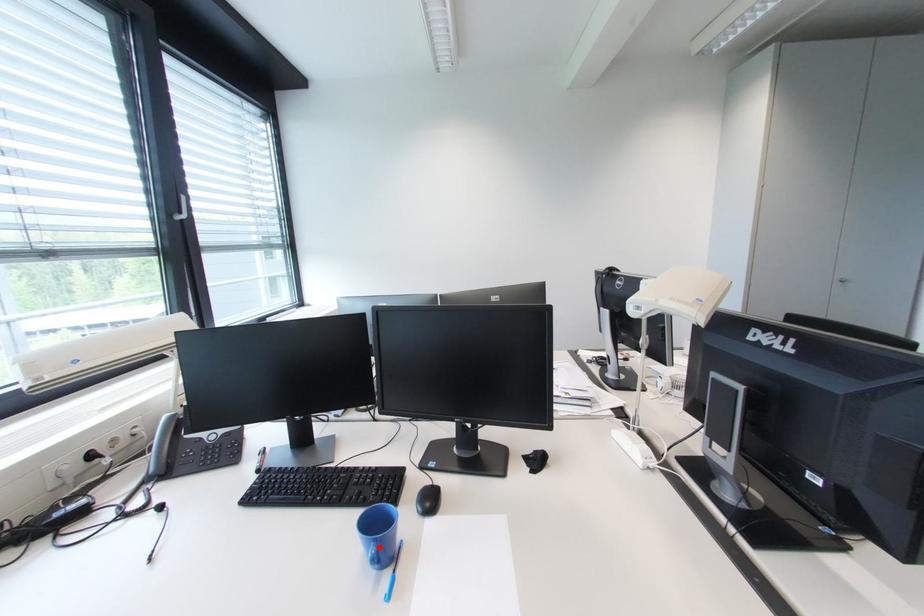
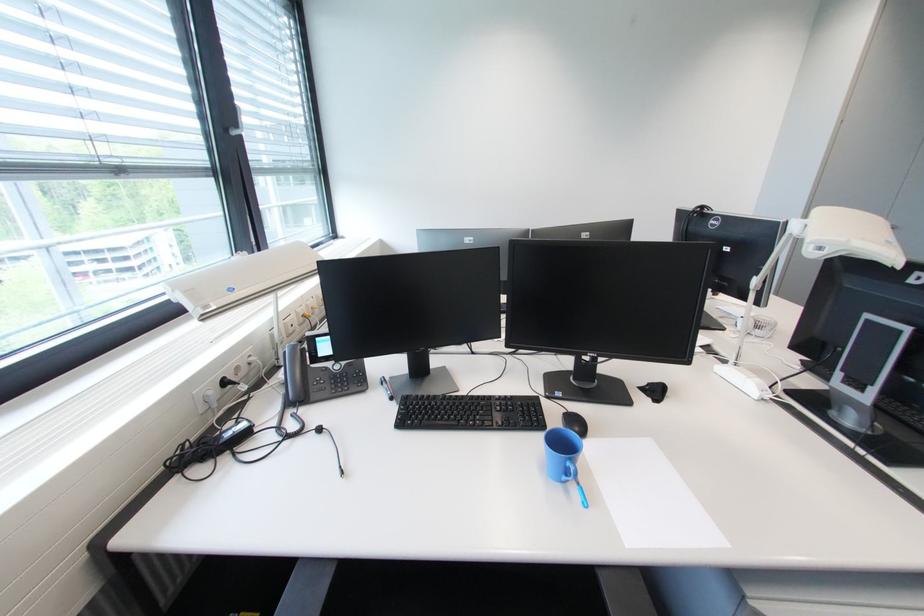
The point at the highlighted location is marked in the first image. Where is the corresponding point in the second image?

(575, 464)